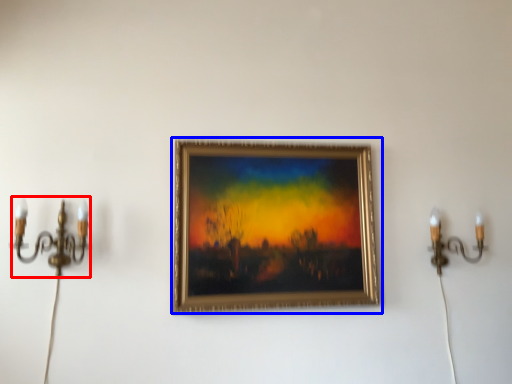
Question: Among these objects, which one is nearest to the camera, candle holder (highlighted by a red box) or picture frame (highlighted by a blue box)?

Choices:
 (A) candle holder
 (B) picture frame

Answer: (A)